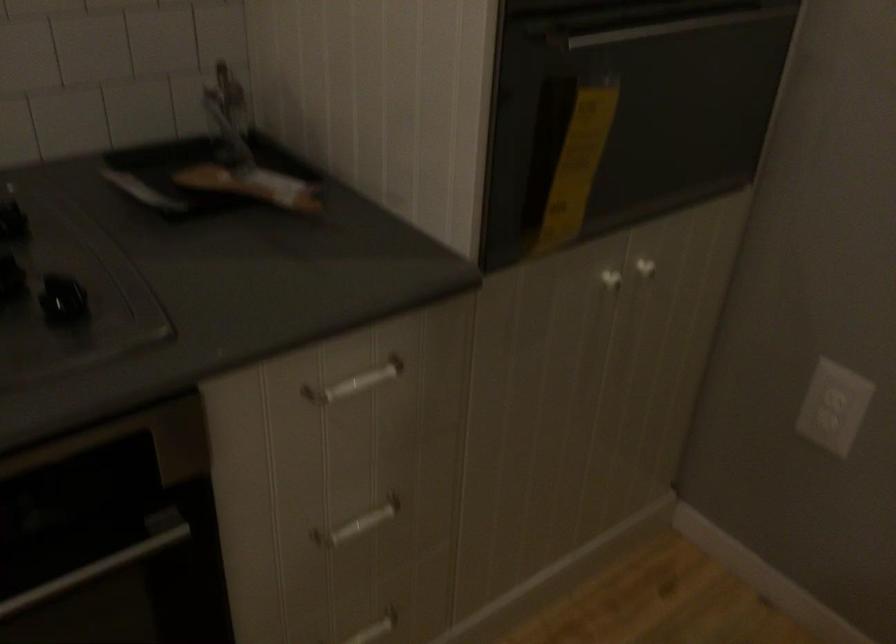
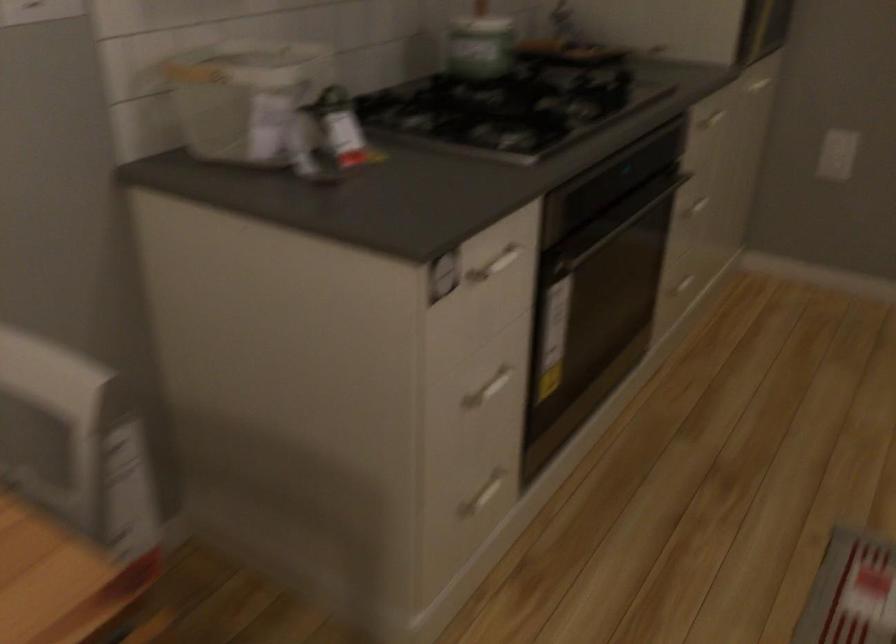
The point at [352,516] is marked in the first image. Where is the corresponding point in the second image?

(694, 204)